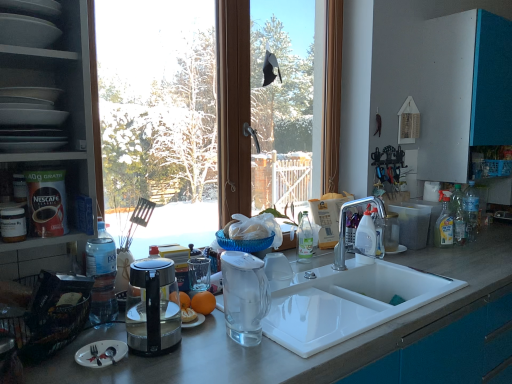
Find the location of `vacant area situated to the left side of white plastic bottle at sink right, which is counted as the 1th bottle, starting from the left`. vacant area situated to the left side of white plastic bottle at sink right, which is counted as the 1th bottle, starting from the left is located at coordinates (328, 265).